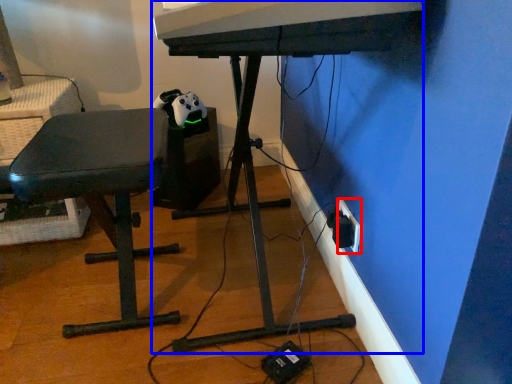
Question: Which point is further to the camera, electric outlet (highlighted by a red box) or computer desk (highlighted by a blue box)?

Choices:
 (A) electric outlet
 (B) computer desk

Answer: (A)